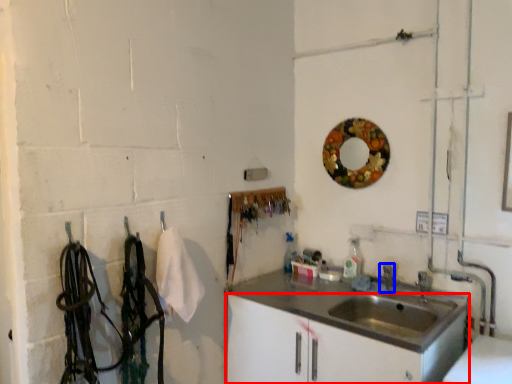
Question: Which object is closer to the camera taking this photo, bathroom cabinet (highlighted by a red box) or faucet (highlighted by a blue box)?

Choices:
 (A) bathroom cabinet
 (B) faucet

Answer: (A)